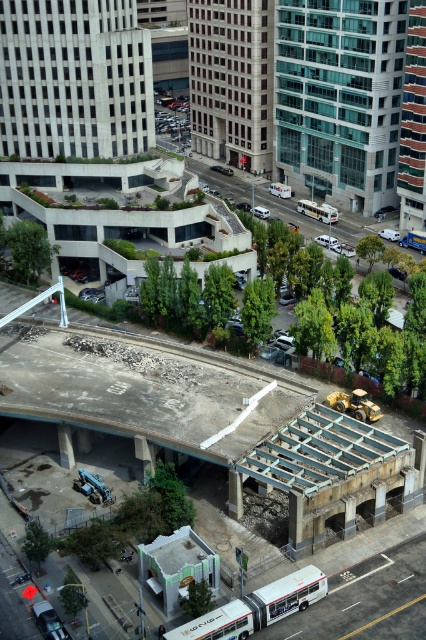
Question: Which object is positioned farthest from the blue metallic bus at center?

Choices:
 (A) matte silver sedan at center
 (B) white matte bus at lower center

Answer: (B)

Question: Which point is farther from the camera taking this photo?

Choices:
 (A) click(261, 211)
 (B) click(307, 198)
 (C) click(213, 620)
 (D) click(425, 241)

Answer: (B)

Question: Is white matte bus at center to the right of blue metallic bus at center from the viewer's perspective?

Choices:
 (A) yes
 (B) no

Answer: (B)

Question: Does white matte bus at lower center have a smaller size compared to blue metallic bus at center?

Choices:
 (A) yes
 (B) no

Answer: (B)

Question: Which point is farther from the camera taking this photo?

Choices:
 (A) (307, 605)
 (B) (298, 205)
 (C) (253, 205)
 (D) (402, 244)

Answer: (C)

Question: Is blue metallic bus at center above matte silver sedan at center?

Choices:
 (A) no
 (B) yes

Answer: (A)